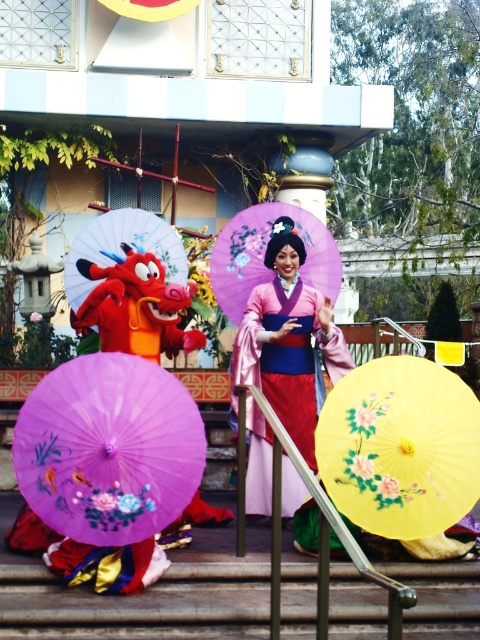
Is yellow paper umbrella at center to the left of matte purple parasol at center from the viewer's perspective?

Incorrect, yellow paper umbrella at center is not on the left side of matte purple parasol at center.

Which is below, yellow paper umbrella at center or matte purple parasol at center?

Positioned lower is yellow paper umbrella at center.

Where is `yellow paper umbrella at center`? This screenshot has width=480, height=640. yellow paper umbrella at center is located at coordinates (399, 448).

Can you confirm if purple paper umbrella at center is smaller than pink satin kimono at center?

Indeed, purple paper umbrella at center has a smaller size compared to pink satin kimono at center.

The height and width of the screenshot is (640, 480). Identify the location of purple paper umbrella at center. point(108,449).

Identify the location of purple paper umbrella at center. This screenshot has width=480, height=640. (108, 449).

In the scene shown: Is pink satin kimono at center shorter than matte purple parasol at center?

No.

Between point (284, 272) and point (126, 212), which one is positioned in front?

Point (126, 212)

This screenshot has height=640, width=480. I want to click on pink satin kimono at center, so click(288, 355).